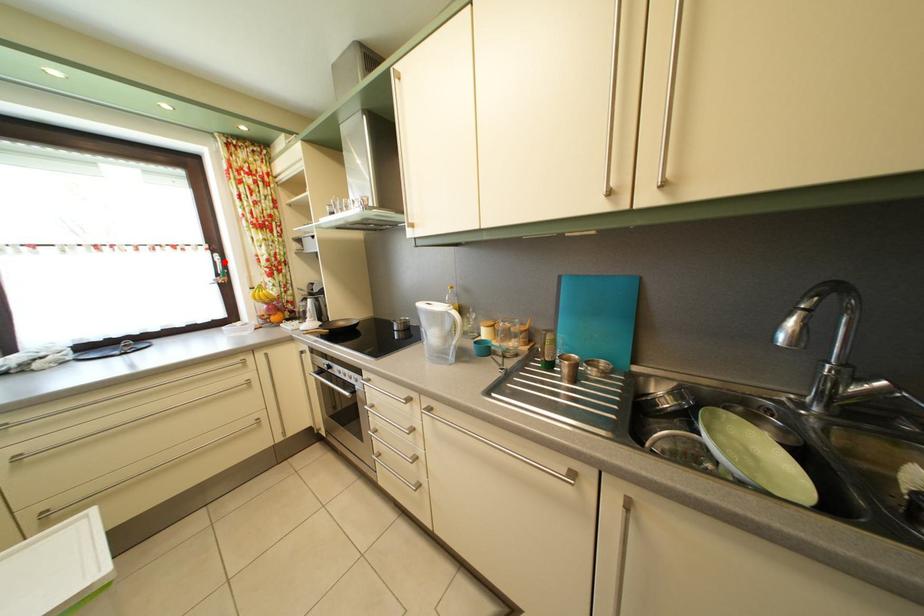
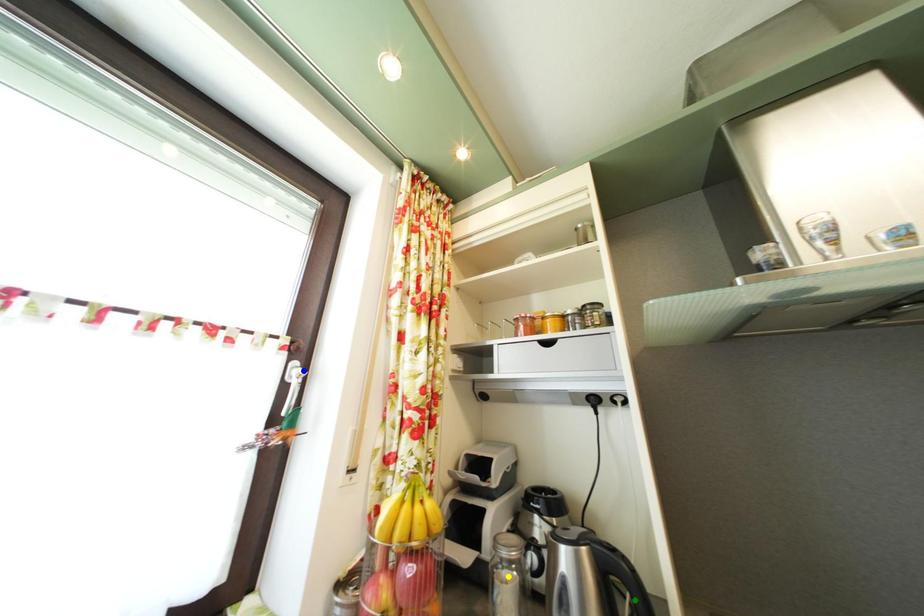
Question: I am providing you with two images of the same scene from different viewpoints. A red point is marked on the first image. You are given multiple points on the second image. In image 2, which mark is for the same physical point as the one in image 1?

Choices:
 (A) yellow point
 (B) green point
 (C) blue point

Answer: (C)